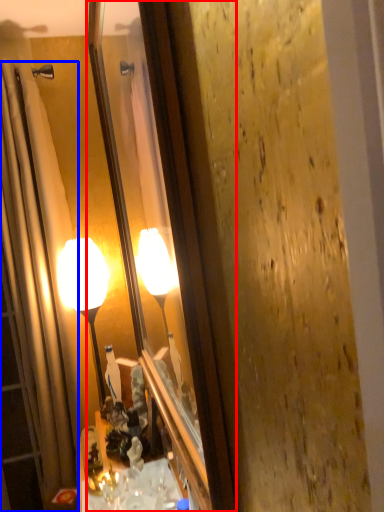
Question: Which of the following is the farthest to the observer, mirror (highlighted by a red box) or shower curtain (highlighted by a blue box)?

Choices:
 (A) mirror
 (B) shower curtain

Answer: (B)